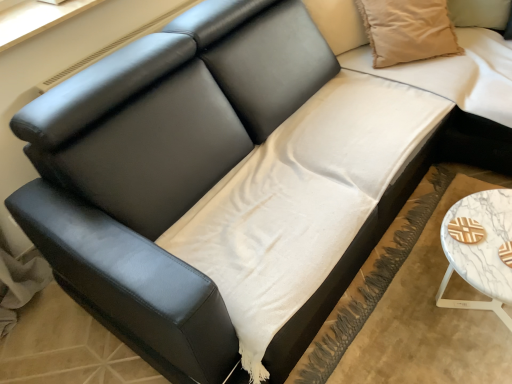
Question: Is point (509, 216) positioned closer to the camera than point (251, 244)?

Choices:
 (A) farther
 (B) closer

Answer: (A)

Question: Looking at their shapes, would you say white marble table at lower right is wider or thinner than white cotton sheet at center?

Choices:
 (A) thin
 (B) wide

Answer: (A)

Question: Estimate the real-world distances between objects in this image. Which object is closer to the white cotton sheet at center?

Choices:
 (A) beige cotton pillow at upper right
 (B) white marble table at lower right

Answer: (B)

Question: Based on their relative distances, which object is farther from the white cotton sheet at center?

Choices:
 (A) beige cotton pillow at upper right
 (B) white marble table at lower right

Answer: (A)